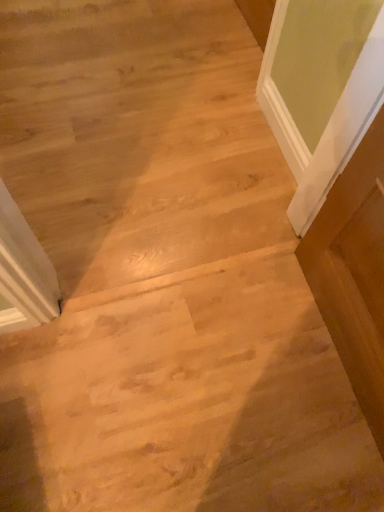
Image resolution: width=384 pixels, height=512 pixels. Find the location of `wooden door at right`. wooden door at right is located at coordinates (354, 272).

What do you see at coordinates (354, 272) in the screenshot?
I see `wooden door at right` at bounding box center [354, 272].

What is the approximate height of wooden door at right?

28.96 inches.

This screenshot has width=384, height=512. In order to click on wooden door at right in this screenshot , I will do `click(354, 272)`.